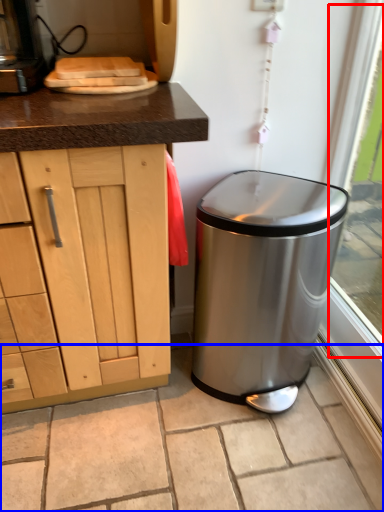
Question: Which object appears farthest to the camera in this image, window screen (highlighted by a red box) or granite (highlighted by a blue box)?

Choices:
 (A) window screen
 (B) granite

Answer: (B)